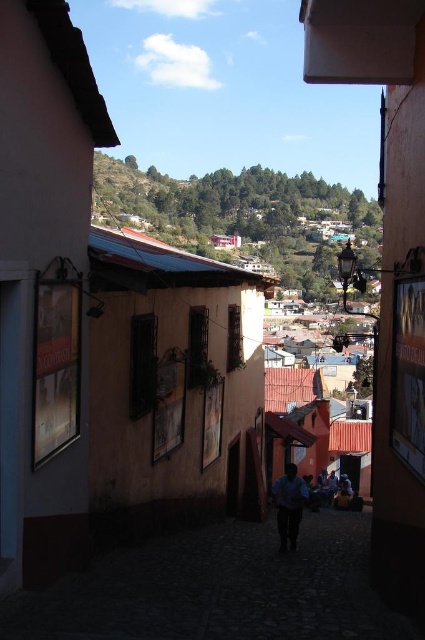
The width and height of the screenshot is (425, 640). What do you see at coordinates (218, 589) in the screenshot?
I see `dark stone alley at center` at bounding box center [218, 589].

Based on the photo, who is higher up, dark stone alley at center or blue fabric shirt at center?

dark stone alley at center

Who is more distant from viewer, (360, 573) or (283, 499)?

The point (283, 499) is behind.

Locate an element on the screen. dark stone alley at center is located at coordinates (218, 589).

Does matte orange building at center have a larger size compared to dark stone alley at center?

Indeed, matte orange building at center has a larger size compared to dark stone alley at center.

How far apart are matte orange building at center and dark stone alley at center?

matte orange building at center and dark stone alley at center are 242.88 feet apart.

Locate an element on the screen. matte orange building at center is located at coordinates (204, 380).

Is point (252, 369) positioned after point (294, 508)?

Yes.

Does matte orange building at center have a greater height compared to blue fabric shirt at center?

Yes.

Measure the distance between matte orange building at center and camera.

The distance of matte orange building at center from camera is 21.11 meters.

Locate an element on the screen. matte orange building at center is located at coordinates (204, 380).